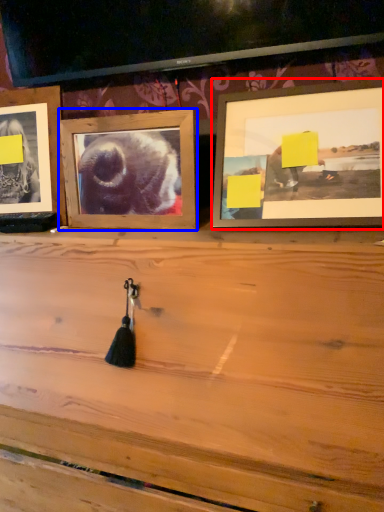
Question: Among these objects, which one is farthest to the camera, picture frame (highlighted by a red box) or picture frame (highlighted by a blue box)?

Choices:
 (A) picture frame
 (B) picture frame

Answer: (B)